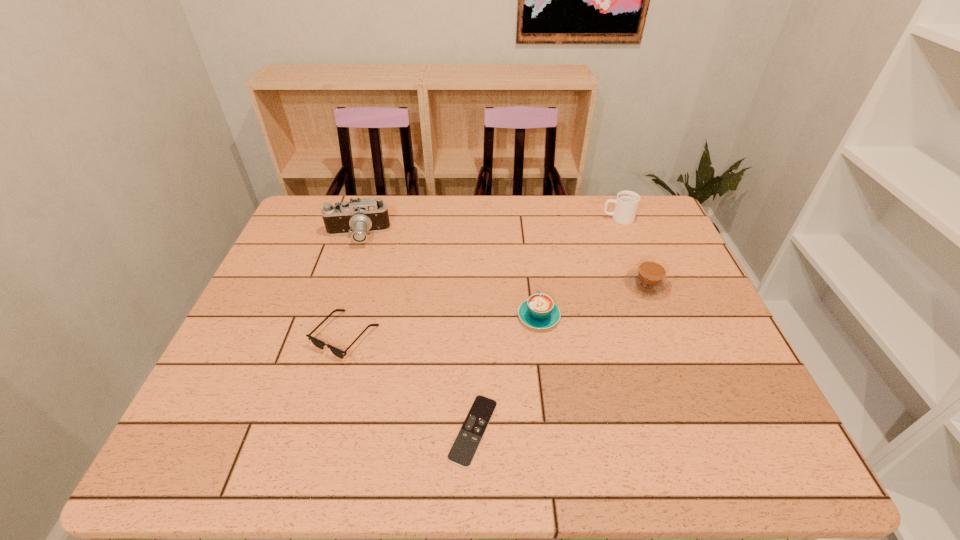
This screenshot has height=540, width=960. Find the location of `free space between the shortest cappuccino and the third tallest object`. free space between the shortest cappuccino and the third tallest object is located at coordinates (593, 300).

At what (x,y) coordinates should I click in order to perform the action: click on the third closest object to the remote control. Please return your answer as a coordinate pair (x, y). This screenshot has height=540, width=960. Looking at the image, I should click on (649, 279).

At what (x,y) coordinates should I click in order to perform the action: click on the fourth closest object to the shortest object. Please return your answer as a coordinate pair (x, y). This screenshot has width=960, height=540. Looking at the image, I should click on (357, 218).

Where is `cappuccino object that ranks as the closest to the fourth shortest object`? The image size is (960, 540). cappuccino object that ranks as the closest to the fourth shortest object is located at coordinates (539, 311).

I want to click on the second closest cappuccino to the fourth nearest object, so click(x=626, y=203).

Where is `free space in the image that satisfies the following two spatial constraints: 1. on the lenses of the second shortest object; 2. on the right side of the nearest object`? This screenshot has height=540, width=960. free space in the image that satisfies the following two spatial constraints: 1. on the lenses of the second shortest object; 2. on the right side of the nearest object is located at coordinates (318, 430).

Where is `blank space that satisfies the following two spatial constraints: 1. on the lenses of the shortest object; 2. on the left side of the sunglasses`? Image resolution: width=960 pixels, height=540 pixels. blank space that satisfies the following two spatial constraints: 1. on the lenses of the shortest object; 2. on the left side of the sunglasses is located at coordinates (318, 430).

The image size is (960, 540). In order to click on free space that satisfies the following two spatial constraints: 1. with the handle on the right side of the shortest cappuccino; 2. on the right side of the second nearest cappuccino in this screenshot , I will do `click(535, 284)`.

You are a GUI agent. You are given a task and a screenshot of the screen. Output one action in this format:
    pyautogui.click(x=<x>, y=<y>)
    Task: Click on the vacant region that satisfies the following two spatial constraints: 1. on the side with the handle of the tallest cappuccino; 2. at the lens of the tallest object
    The height and width of the screenshot is (540, 960).
    Given the screenshot: What is the action you would take?
    pyautogui.click(x=625, y=236)

Image resolution: width=960 pixels, height=540 pixels. Identify the location of blank area in the image that satisfies the following two spatial constraints: 1. on the lenses of the sunglasses; 2. on the right side of the shortest object. (318, 430).